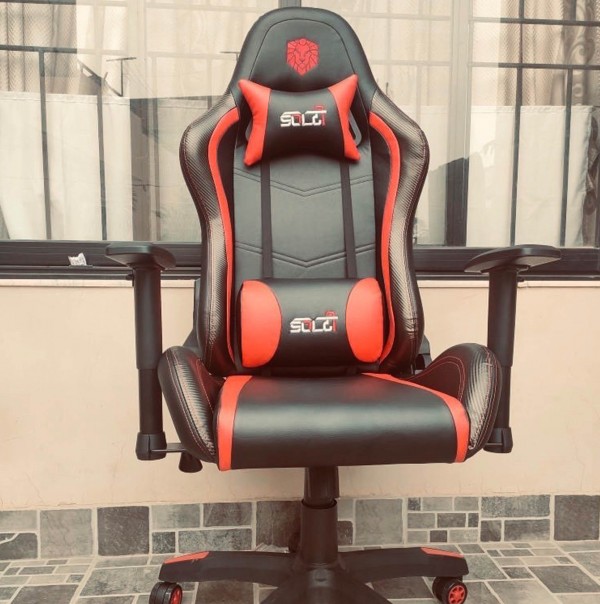
Locate an element on the screen. left arm rest is located at coordinates (513, 249).